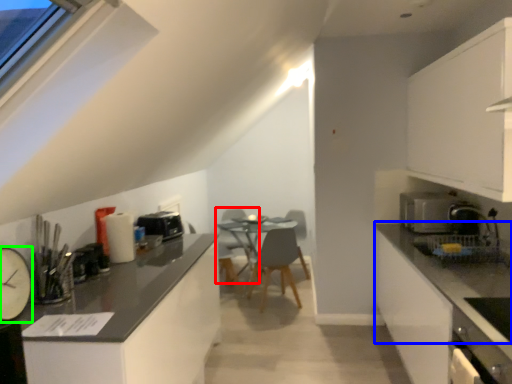
Question: Which object is the farthest from swivel chair (highlighted by a red box)? Choose among these: countertop (highlighted by a blue box) or appliance (highlighted by a green box).

Choices:
 (A) countertop
 (B) appliance

Answer: (B)